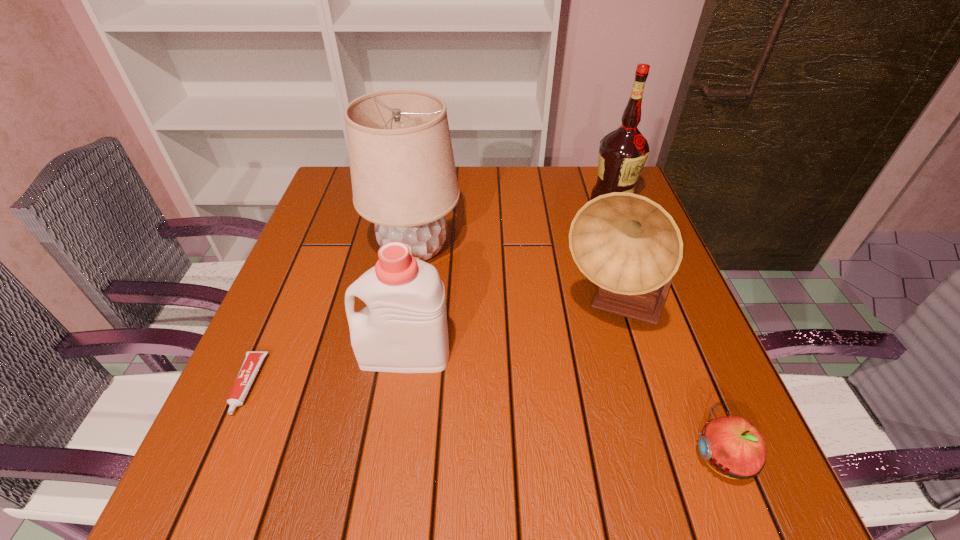
Locate an element on the screen. free space at the near right corner of the desktop is located at coordinates (684, 503).

You are a GUI agent. You are given a task and a screenshot of the screen. Output one action in this format:
    pyautogui.click(x=<x>, y=<y>)
    Task: Click on the free space between the lampshade and the apple
    
    Given the screenshot: What is the action you would take?
    pyautogui.click(x=567, y=353)

The image size is (960, 540). Find the location of `unoccupied position between the nearest object and the phonograph record`. unoccupied position between the nearest object and the phonograph record is located at coordinates (668, 383).

Where is `vacant space that is in between the nearest object and the toothpaste`? The image size is (960, 540). vacant space that is in between the nearest object and the toothpaste is located at coordinates (484, 421).

You are a GUI agent. You are given a task and a screenshot of the screen. Output one action in this format:
    pyautogui.click(x=<x>, y=<y>)
    Task: Click on the empty space between the third shortest object and the shortest object
    
    Given the screenshot: What is the action you would take?
    pyautogui.click(x=325, y=369)

Where is `free point between the lampshade and the apple`? free point between the lampshade and the apple is located at coordinates (567, 353).

The image size is (960, 540). What are the coordinates of `free spot between the detergent and the toothpaste` in the screenshot? It's located at pos(325,369).

Where is `vacant space that's between the apple and the toothpaste`? vacant space that's between the apple and the toothpaste is located at coordinates (484, 421).

Image resolution: width=960 pixels, height=540 pixels. I want to click on vacant point located between the lampshade and the phonograph record, so click(x=515, y=279).

The image size is (960, 540). I want to click on vacant point located between the phonograph record and the lampshade, so click(515, 279).